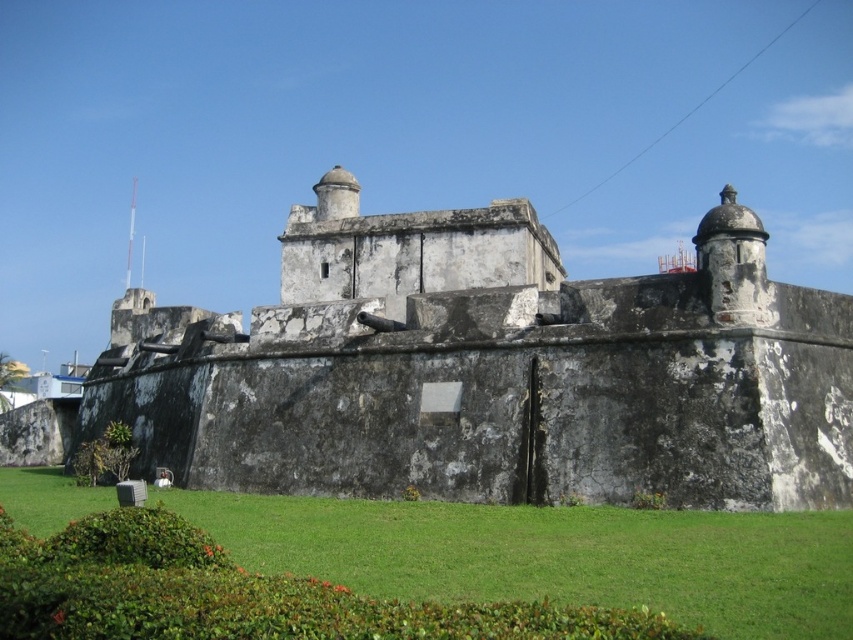
From the picture: Who is lower down, weathered stone wall at center or green grass at lower center?

Positioned lower is green grass at lower center.

Who is more distant from viewer, [482,259] or [665,604]?

Point [482,259]

I want to click on weathered stone wall at center, so 492,372.